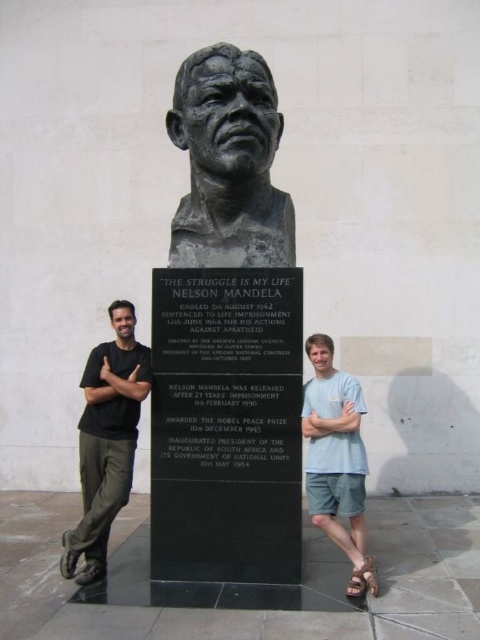
You are standing in front of the bronze bust of Nelson Mandela on the black granite pedestal. You notice two points marked on the pedestal. The first point is at coordinates point (269, 240) and the second is at point (116, 396). Which point is closer to you as you face the pedestal?

Point (269, 240) is in front of point (116, 396), so it is closer to you as you face the pedestal.

What are the coordinates of the bronze sculpture at center?

The bronze sculpture at center is located at point (x=228, y=163).